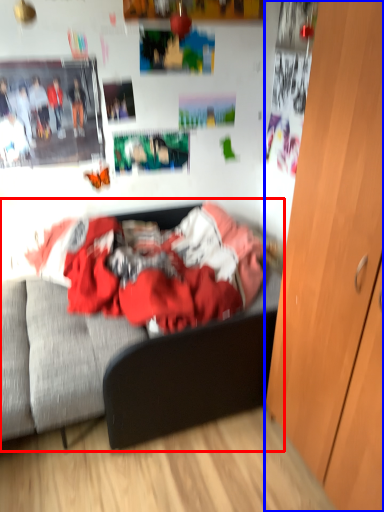
Question: Which point is closer to the camera, bed (highlighted by a red box) or cabinetry (highlighted by a blue box)?

Choices:
 (A) bed
 (B) cabinetry

Answer: (B)